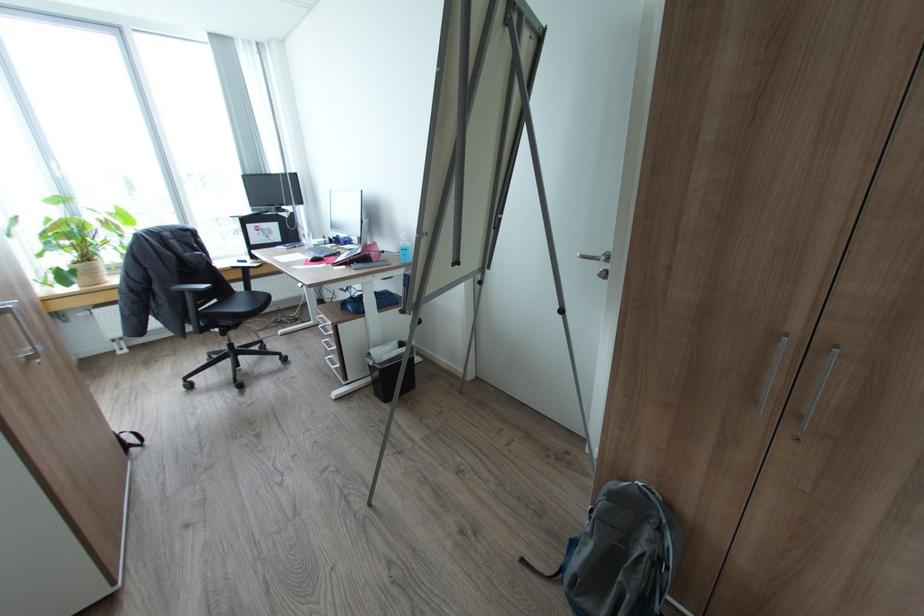
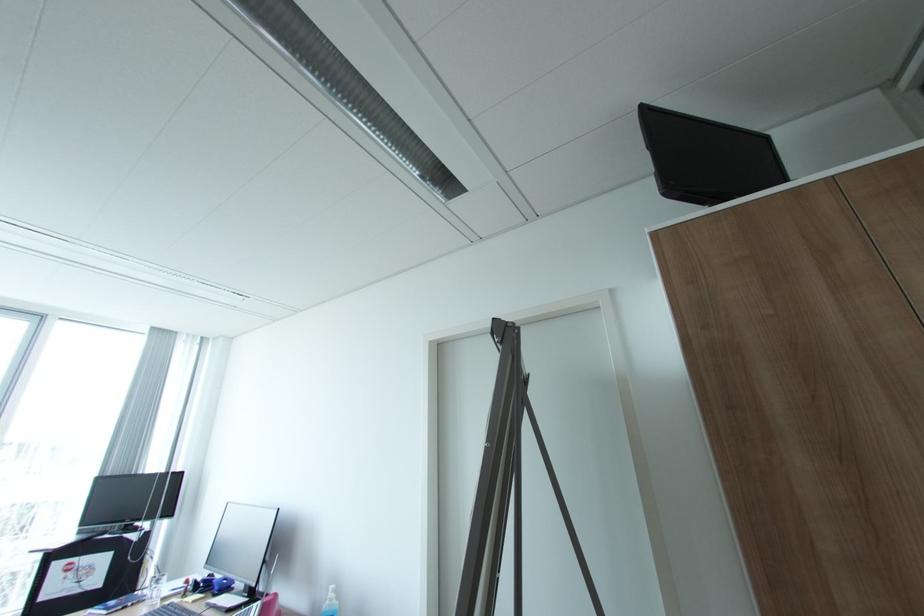
Find the pixel in the second image that matches (x=408, y=240) in the first image.

(336, 599)